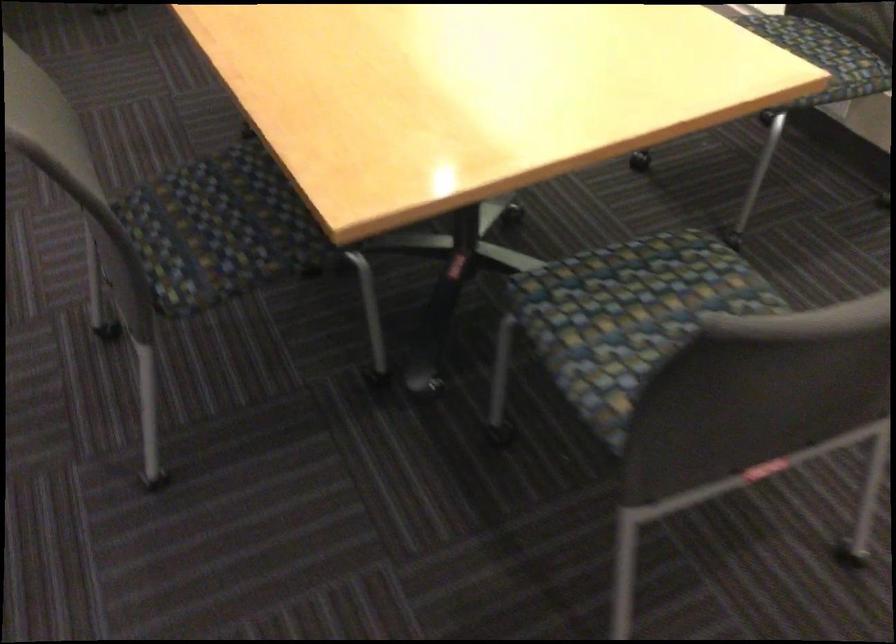
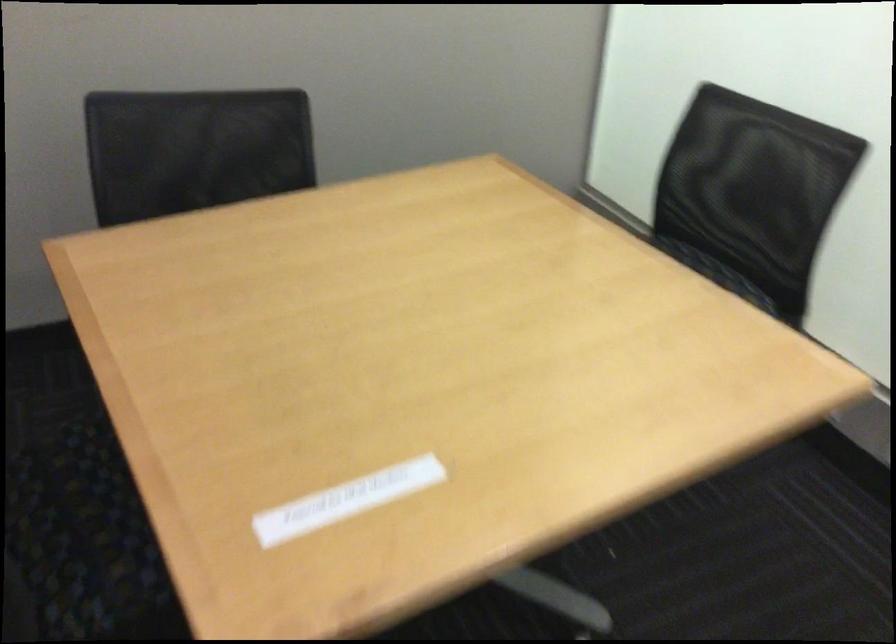
The images are taken continuously from a first-person perspective. In which direction are you moving?

The movement direction of the cameraman is left, forward.